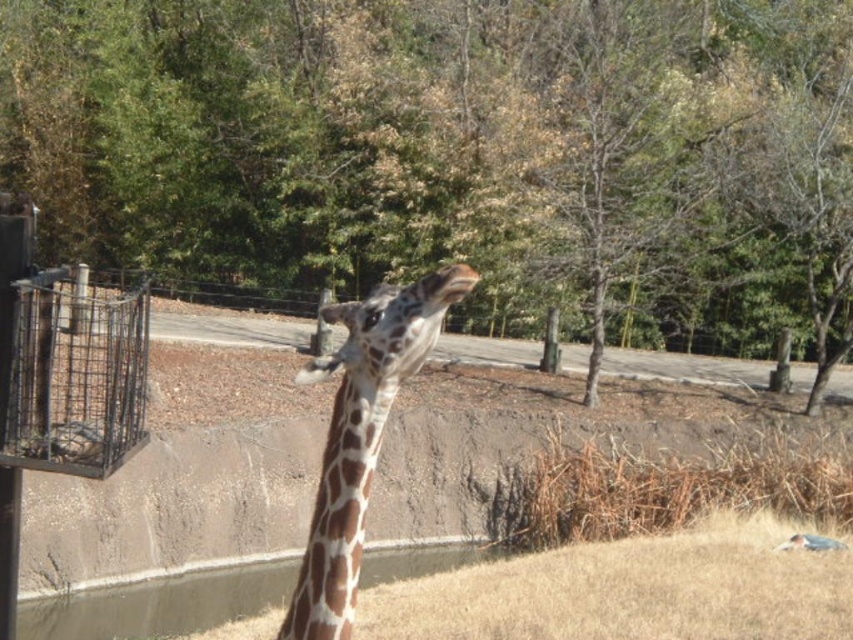
You are standing at the entrance of the zoo and see the giraffe. There are two points marked in the image. The first point is at coordinate point (x=602, y=51) and the second is at point (x=105, y=323). If you want to take a photo that includes both points, which point should you focus on first to ensure both are in frame?

Point (x=602, y=51) is further to the camera than point (x=105, y=323), so you should focus on point (x=602, y=51) first to ensure both points are within the camera frame.